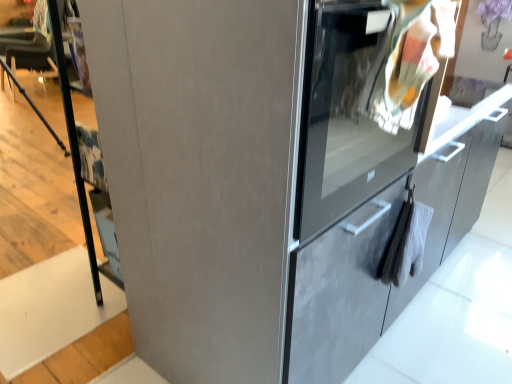
This screenshot has width=512, height=384. Find the location of `satin gray cabinet at right`. satin gray cabinet at right is located at coordinates (385, 248).

What is the approximate height of satin gray cabinet at right?

The height of satin gray cabinet at right is 34.09 inches.

This screenshot has width=512, height=384. Find the location of `white matte stair at lower left`. white matte stair at lower left is located at coordinates (51, 309).

You are a GUI agent. You are given a task and a screenshot of the screen. Output one action in this format:
    pyautogui.click(x=<x>, y=<y>)
    Task: Click on the satin gray cabinet at right
    This screenshot has height=384, width=512.
    Given the screenshot: What is the action you would take?
    [x=385, y=248]

How different are the orientations of white matte stair at lower left and satin gray oven at right in degrees?

179 degrees separate the facing orientations of white matte stair at lower left and satin gray oven at right.

Is white matte stair at lower left next to satin gray oven at right?

No, white matte stair at lower left is not touching satin gray oven at right.

Based on the photo, is white matte stair at lower left positioned before satin gray oven at right?

That is False.

Are satin gray cabinet at right and white matte stair at lower left located far from each other?

Indeed, satin gray cabinet at right is not near white matte stair at lower left.

This screenshot has height=384, width=512. In the image, there is a satin gray cabinet at right. What are the coordinates of `stair below it (from the image's perspective)` in the screenshot? It's located at tap(51, 309).

Considering the sizes of satin gray cabinet at right and white matte stair at lower left in the image, is satin gray cabinet at right bigger or smaller than white matte stair at lower left?

Clearly, satin gray cabinet at right is larger in size than white matte stair at lower left.

Between satin gray cabinet at right and white matte stair at lower left, which one has smaller width?

Thinner between the two is satin gray cabinet at right.

Is satin gray oven at right turned away from satin gray cabinet at right?

No.

Is the position of satin gray oven at right more distant than that of satin gray cabinet at right?

Yes, satin gray oven at right is further from the viewer.

Looking at this image, which of these two, satin gray oven at right or satin gray cabinet at right, is thinner?

satin gray cabinet at right.

Between satin gray oven at right and satin gray cabinet at right, which one has more height?

satin gray cabinet at right is taller.

Based on their positions, is satin gray cabinet at right located to the left or right of satin gray oven at right?

Clearly, satin gray cabinet at right is on the right of satin gray oven at right in the image.

Locate an element on the screen. Image resolution: width=512 pixels, height=384 pixels. cabinetry that appears above the satin gray oven at right (from a real-world perspective) is located at coordinates (385, 248).

Is satin gray cabinet at right in contact with satin gray oven at right?

No, satin gray cabinet at right is not touching satin gray oven at right.

Between satin gray oven at right and white matte stair at lower left, which one has larger width?

With larger width is satin gray oven at right.

The width and height of the screenshot is (512, 384). Find the location of `door beneath the white matte stair at lower left (from a real-world perspective)`. door beneath the white matte stair at lower left (from a real-world perspective) is located at coordinates (200, 175).

Can you confirm if satin gray oven at right is shorter than white matte stair at lower left?

No, satin gray oven at right is not shorter than white matte stair at lower left.

Which is correct: white matte stair at lower left is inside satin gray cabinet at right, or outside of it?

white matte stair at lower left cannot be found inside satin gray cabinet at right.

Would you say white matte stair at lower left is a long distance from satin gray cabinet at right?

Indeed, white matte stair at lower left is not near satin gray cabinet at right.

From a real-world perspective, between white matte stair at lower left and satin gray cabinet at right, who is vertically higher?

In real-world perspective, satin gray cabinet at right is above.

In the scene shown: Is the position of white matte stair at lower left more distant than that of satin gray cabinet at right?

Yes, it is behind satin gray cabinet at right.

You are a GUI agent. You are given a task and a screenshot of the screen. Output one action in this format:
    pyautogui.click(x=<x>, y=<y>)
    Task: Click on the door above the white matte stair at lower left (from the image's perspective)
    The image size is (512, 384).
    Given the screenshot: What is the action you would take?
    pyautogui.click(x=200, y=175)

Where is `cabinetry in front of the white matte stair at lower left`? The height and width of the screenshot is (384, 512). cabinetry in front of the white matte stair at lower left is located at coordinates (385, 248).

When comparing their distances from satin gray cabinet at right, does satin gray oven at right or white matte stair at lower left seem further?

Among the two, white matte stair at lower left is located further to satin gray cabinet at right.

Which object lies nearer to the anchor point white matte stair at lower left, satin gray oven at right or satin gray cabinet at right?

The object closer to white matte stair at lower left is satin gray oven at right.

Based on their spatial positions, is white matte stair at lower left or satin gray oven at right further from satin gray cabinet at right?

Based on the image, white matte stair at lower left appears to be further to satin gray cabinet at right.

From the picture: From the image, which object appears to be farther from white matte stair at lower left, satin gray cabinet at right or satin gray oven at right?

satin gray cabinet at right is positioned further to the anchor white matte stair at lower left.

From the picture: Which object lies nearer to the anchor point satin gray oven at right, white matte stair at lower left or satin gray cabinet at right?

satin gray cabinet at right is closer to satin gray oven at right.

Looking at the image, which one is located closer to satin gray oven at right, satin gray cabinet at right or white matte stair at lower left?

Among the two, satin gray cabinet at right is located nearer to satin gray oven at right.

Find the location of `stair between satin gray oven at right and satin gray cabinet at right`. stair between satin gray oven at right and satin gray cabinet at right is located at coordinates (51, 309).